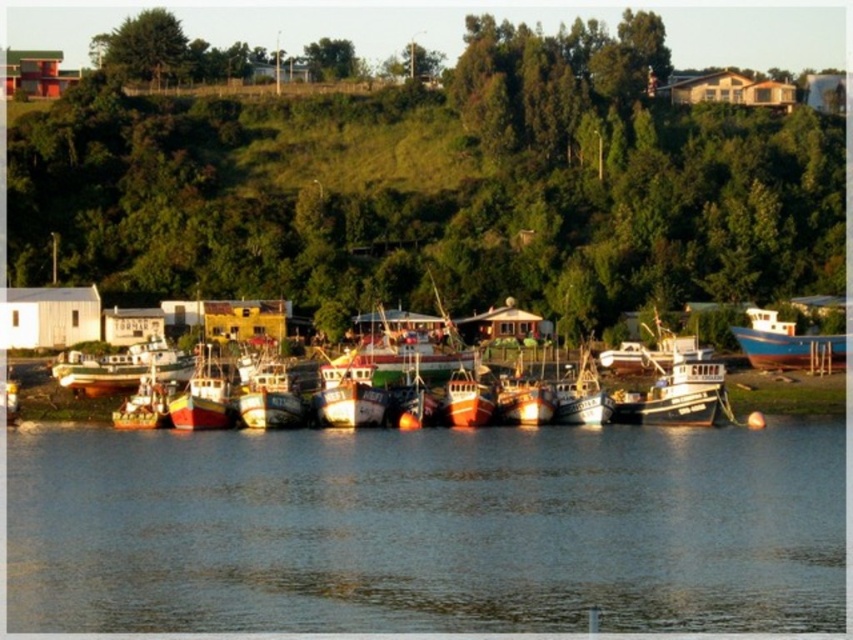
Question: Which object is farther from the camera taking this photo?

Choices:
 (A) blue matte boat at right
 (B) green grassy hillside at upper center
 (C) wooden fishing boat at center
 (D) clear water at center

Answer: (B)

Question: Among these objects, which one is farthest from the camera?

Choices:
 (A) blue matte boat at right
 (B) wooden fishing boat at center
 (C) clear water at center
 (D) green grassy hillside at upper center

Answer: (D)

Question: Can you confirm if green grassy hillside at upper center is smaller than wooden fishing boat at center?

Choices:
 (A) yes
 (B) no

Answer: (B)

Question: Is green grassy hillside at upper center further to camera compared to blue matte boat at right?

Choices:
 (A) yes
 (B) no

Answer: (A)

Question: Observing the image, what is the correct spatial positioning of clear water at center in reference to blue matte boat at right?

Choices:
 (A) below
 (B) above

Answer: (A)

Question: Considering the real-world distances, which object is farthest from the clear water at center?

Choices:
 (A) blue matte boat at right
 (B) green grassy hillside at upper center

Answer: (B)